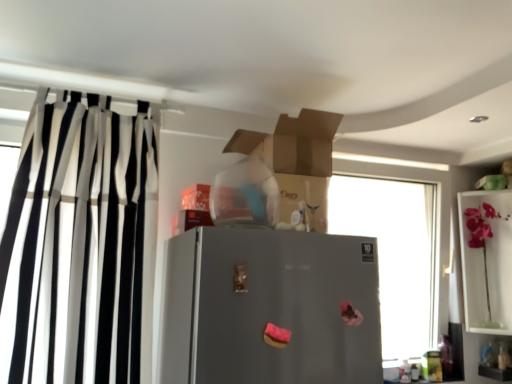
Question: From the image's perspective, is transparent glass window at center located above or below pink glass vase at upper right?

Choices:
 (A) below
 (B) above

Answer: (B)

Question: Looking at the image, does transparent glass window at center seem bigger or smaller compared to pink glass vase at upper right?

Choices:
 (A) big
 (B) small

Answer: (A)

Question: Estimate the real-world distances between objects in this image. Which object is farther from the pink glass vase at upper right?

Choices:
 (A) transparent glass window at center
 (B) black and white striped curtain at left
 (C) gray matte refrigerator at center

Answer: (B)

Question: Considering the real-world distances, which object is farthest from the gray matte refrigerator at center?

Choices:
 (A) pink glass vase at upper right
 (B) transparent glass window at center
 (C) black and white striped curtain at left

Answer: (B)